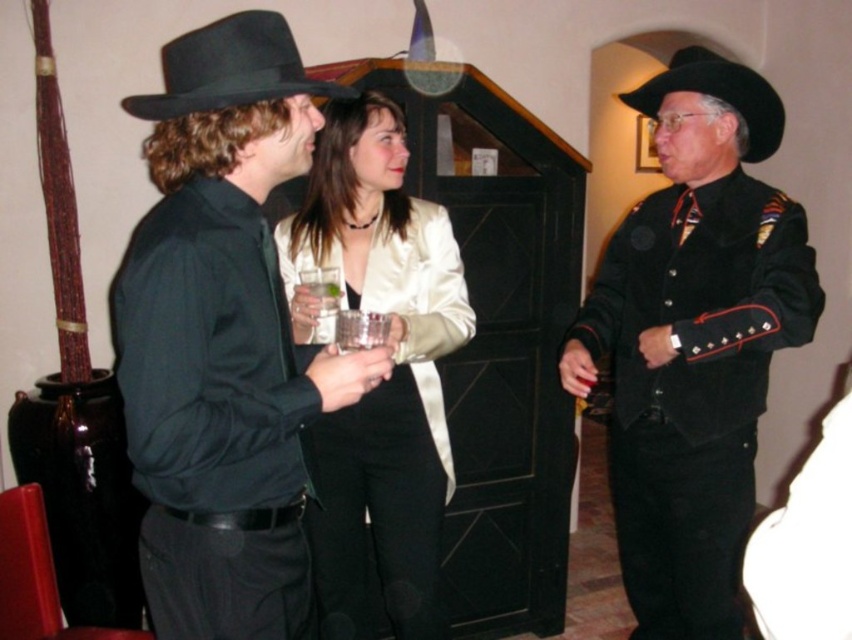
You are a photographer trying to capture a candid shot of both the black suede cowboy hat at upper right and the black felt fedora at left in the same frame. Based on their positions, which hat should you focus on first to ensure both are in the frame?

You should focus on the black felt fedora at left first because the black suede cowboy hat at upper right is positioned below it, meaning adjusting the camera angle to include the lower hat will naturally include the upper one.

You are a photographer at this gathering and want to take a photo of the satin white jacket at center and the black felt fedora at left. Which object should you focus on first if you are moving from left to right across the room?

The black felt fedora at left should be focused on first since it is positioned to the left of the satin white jacket at center when moving from left to right.